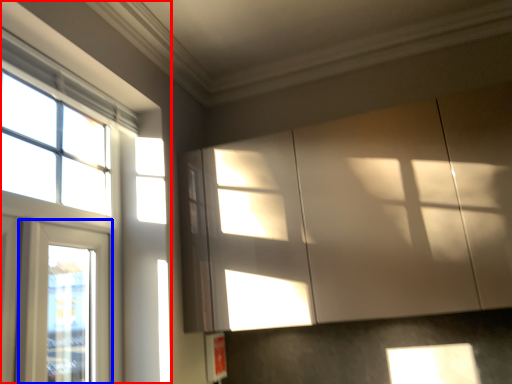
Question: Which object is closer to the camera taking this photo, window (highlighted by a red box) or window (highlighted by a blue box)?

Choices:
 (A) window
 (B) window

Answer: (A)